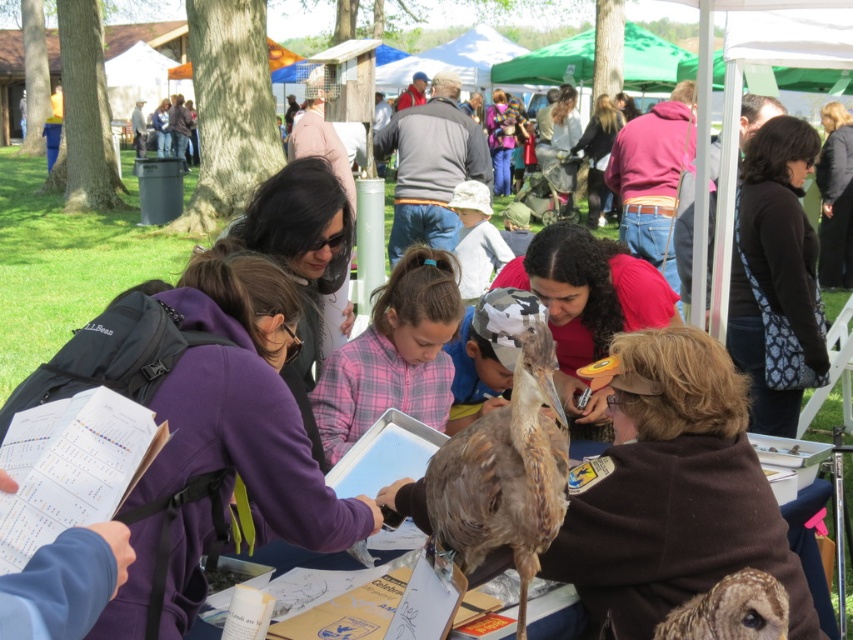
You are standing at the center of the grassy area and see two points marked in the image. The first point is at coordinates point (415, 250) and the second point is at point (668, 300). Which point is closer to you?

Point (415, 250) is in front of point (668, 300), so it is closer to you.

You are a photographer at the event and want to capture a photo of both the pink flannel shirt at center and the matte red shirt at center. Which shirt should you focus on first if you want to include both in the frame without moving the camera?

The pink flannel shirt at center is positioned on the left side of matte red shirt at center, so you should focus on the pink flannel shirt at center first to ensure both are in the frame without moving the camera.

You are a photographer at the event and want to capture a photo of the matte red shirt at center and the matte pink hoodie at center. Which one should you focus on first to ensure both are in the frame?

You should focus on the matte red shirt at center first since it is closer to the viewer than the matte pink hoodie at center, ensuring both are in the frame.